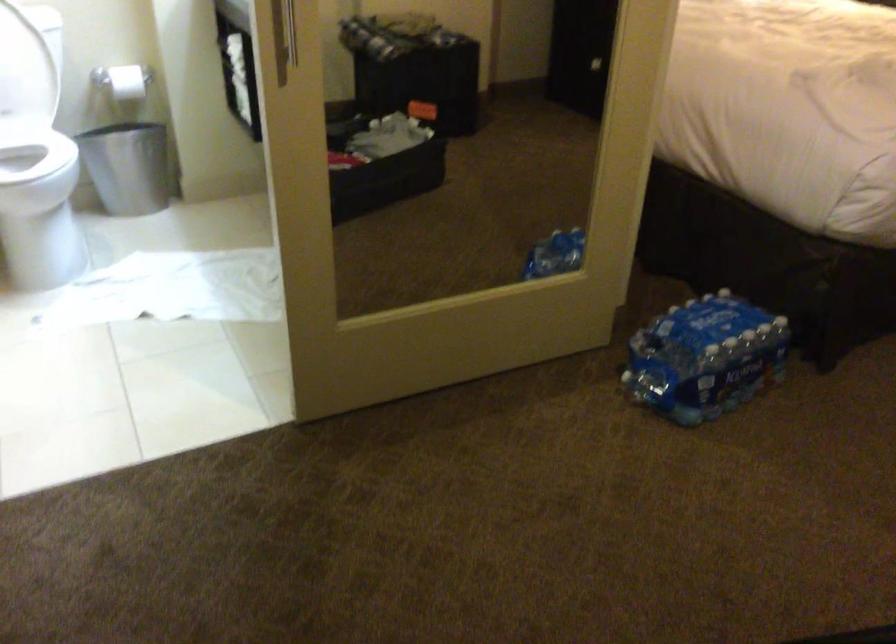
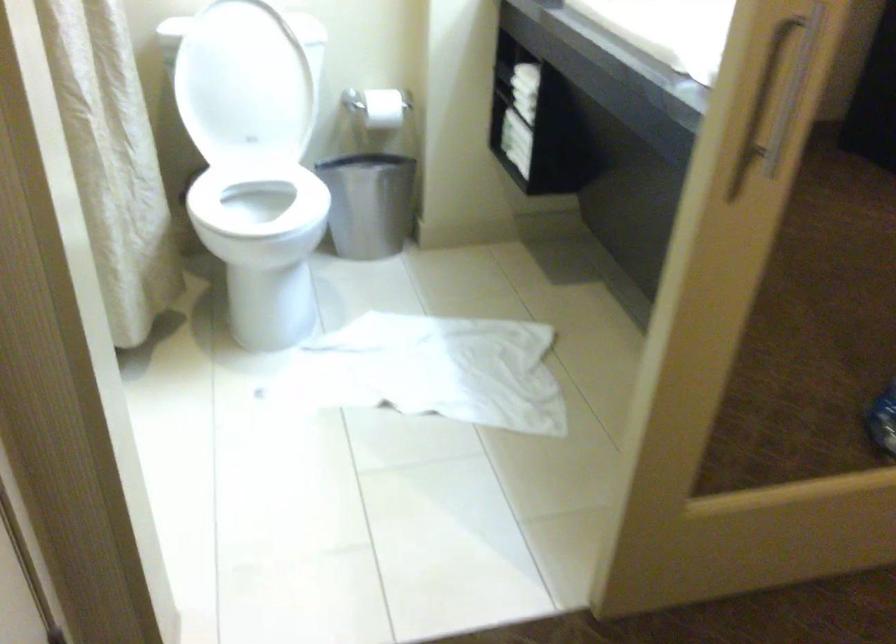
Find the pixel in the second image that matches point 124,77 in the first image.

(383, 108)